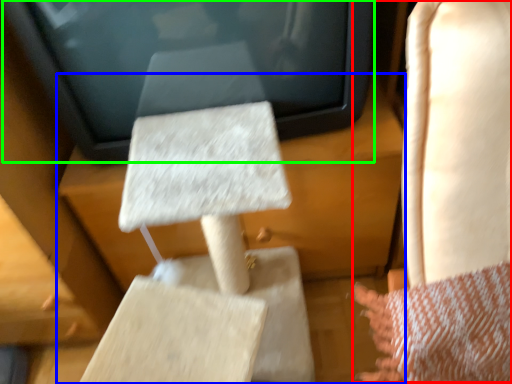
Question: Which object is the farthest from rocking chair (highlighted by a red box)? Choose among these: furniture (highlighted by a blue box) or electronic (highlighted by a green box).

Choices:
 (A) furniture
 (B) electronic

Answer: (A)